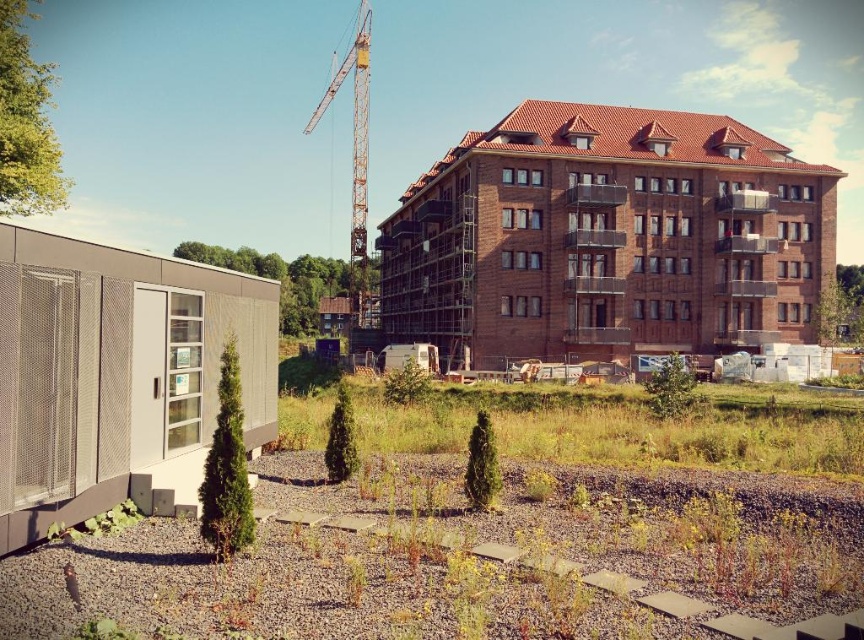
Between point (417, 236) and point (353, 52), which one is positioned in front?

Point (417, 236) is more forward.

This screenshot has height=640, width=864. I want to click on brown brick building at center, so 607,237.